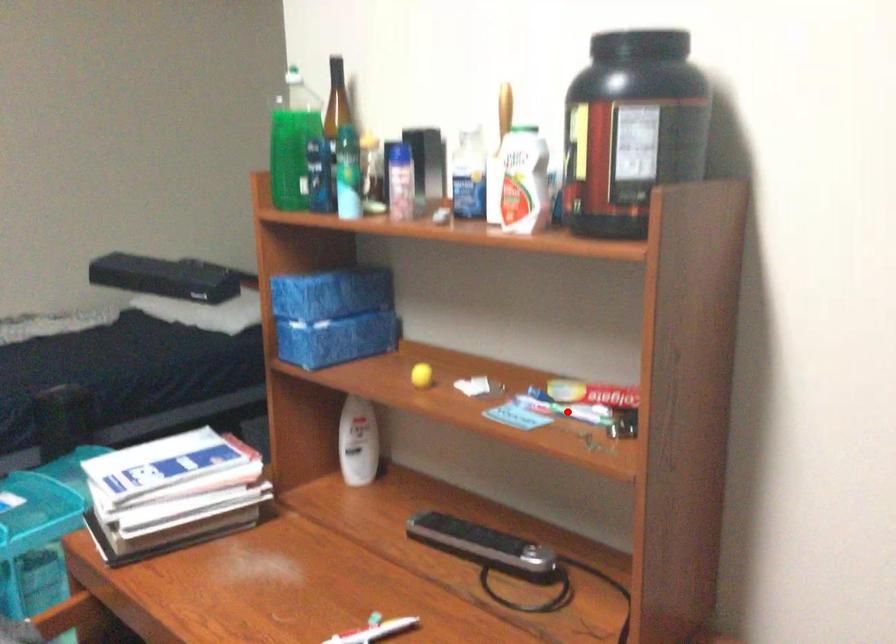
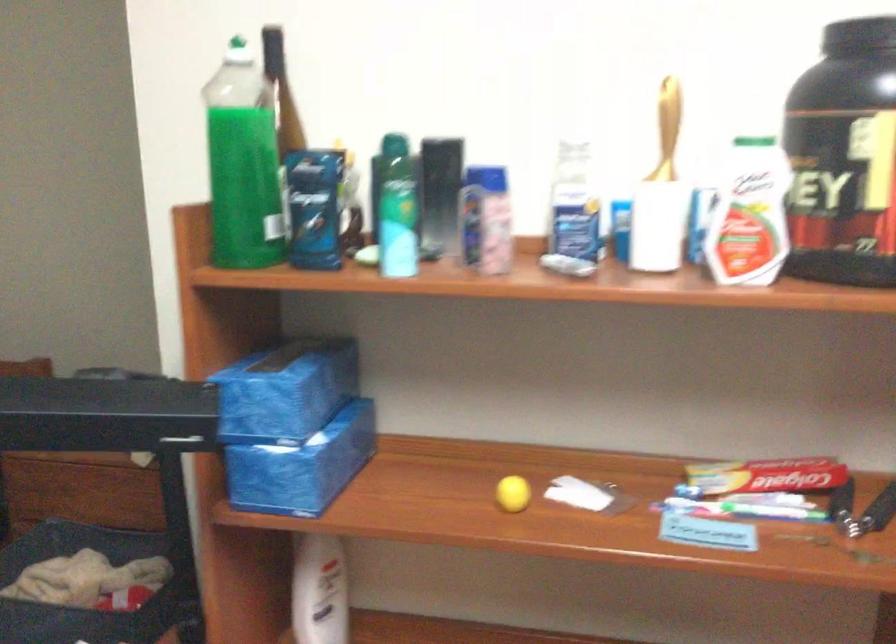
Locate, in the second image, the point that corresponds to the highlighted location in the first image.

(743, 509)